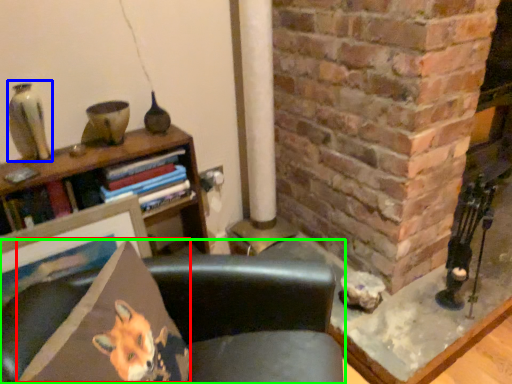
Question: Which object is positioned closest to throw pillow (highlighted by a red box)? Select from gray (highlighted by a blue box) and chair (highlighted by a green box).

Choices:
 (A) gray
 (B) chair

Answer: (B)